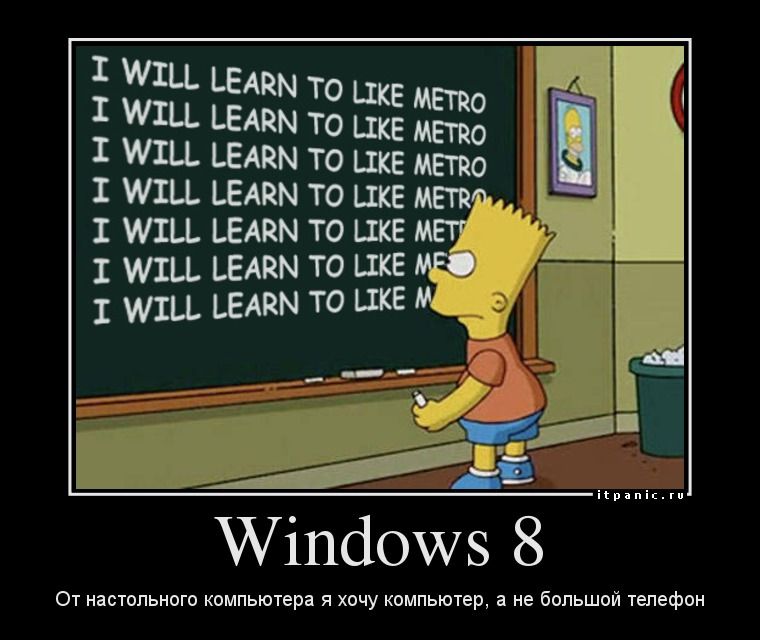
Where is `floor`? This screenshot has height=640, width=760. floor is located at coordinates (599, 477).